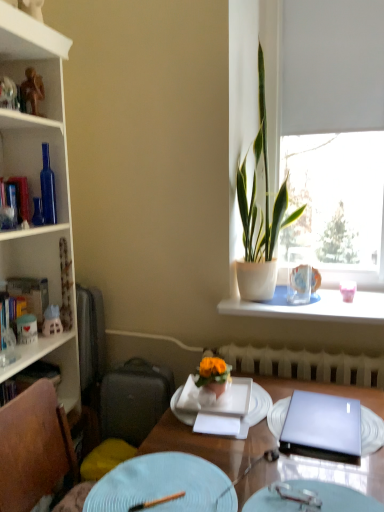
This screenshot has width=384, height=512. What are the coordinates of `free space in front of satin purple laptop at center` in the screenshot? It's located at (323, 479).